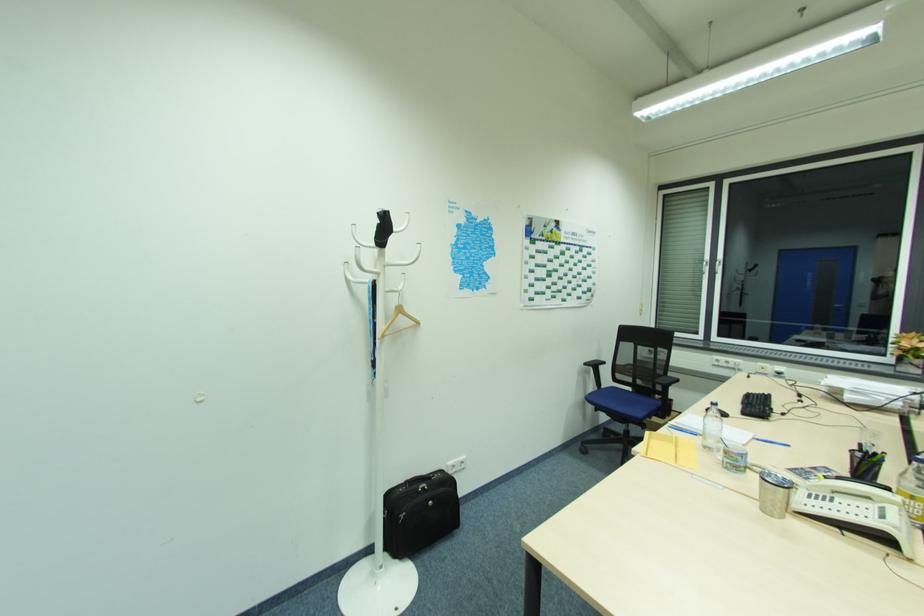
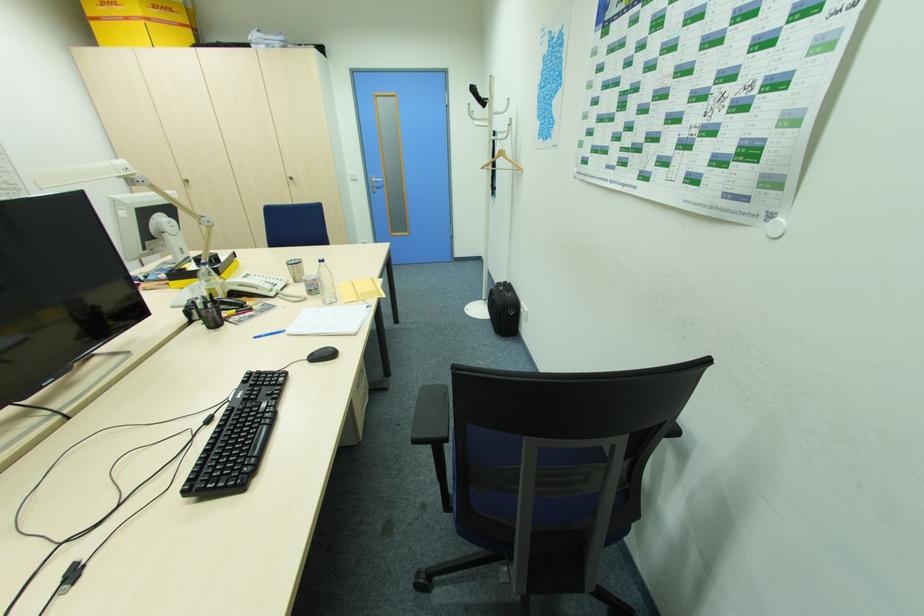
Where in the second image is the point corresponding to point 429,557 from the first image?

(492, 325)